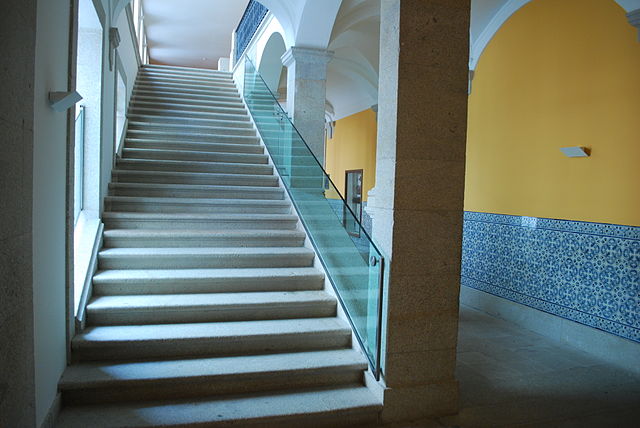
The height and width of the screenshot is (428, 640). I want to click on stairs, so click(x=211, y=185).